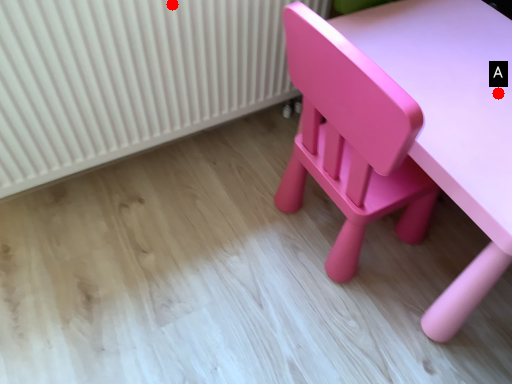
Question: Two points are circled on the image, labeled by A and B beside each circle. Which point appears farthest from the camera in this image?

Choices:
 (A) A is further
 (B) B is further

Answer: (B)